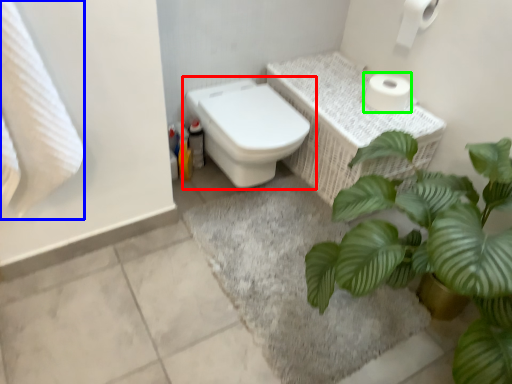
Question: Based on their relative distances, which object is farther from toilet (highlighted by a red box)? Choose from bath towel (highlighted by a blue box) and toilet paper (highlighted by a green box).

Choices:
 (A) bath towel
 (B) toilet paper

Answer: (A)